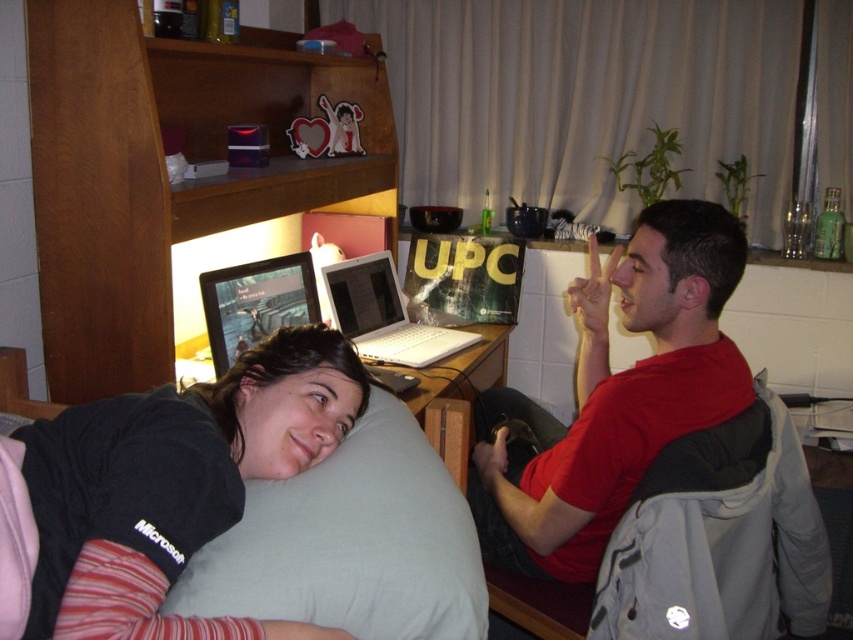
Question: Among these points, which one is nearest to the camera?

Choices:
 (A) (308, 500)
 (B) (372, 305)

Answer: (A)

Question: Which point appears closest to the camera in this image?

Choices:
 (A) (366, 285)
 (B) (589, 573)
 (C) (213, 556)

Answer: (C)

Question: Can you confirm if black fabric pillow at lower left is positioned to the right of gray fabric pillow at lower left?

Choices:
 (A) no
 (B) yes

Answer: (A)

Question: Can you confirm if black fabric pillow at lower left is smaller than gray fabric pillow at lower left?

Choices:
 (A) no
 (B) yes

Answer: (A)

Question: Which object is the farthest from the white plastic laptop at center?

Choices:
 (A) matte black laptop at upper left
 (B) gray fabric pillow at lower left

Answer: (B)

Question: Is red matte shirt at center wider than gray fabric pillow at lower left?

Choices:
 (A) no
 (B) yes

Answer: (B)